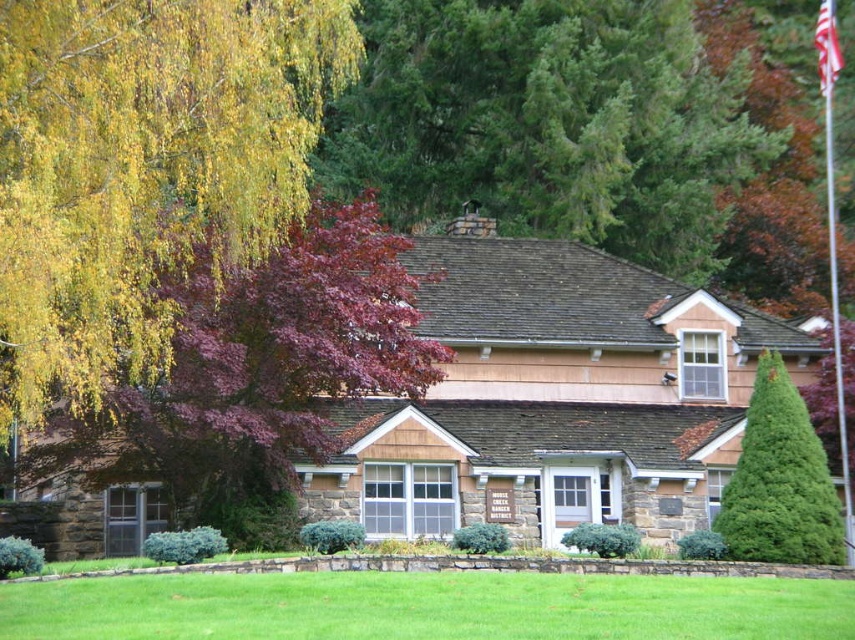
Who is lower down, yellow leafy tree at upper left or purple-leaved tree at left?

purple-leaved tree at left

Who is more distant from viewer, (298,90) or (426,384)?

Point (298,90)

This screenshot has width=855, height=640. What are the coordinates of `yellow leafy tree at upper left` in the screenshot? It's located at (142, 168).

Can you confirm if green grass at lower center is positioned to the right of green needle-like at upper right?

In fact, green grass at lower center is to the left of green needle-like at upper right.

Is point (752, 605) positioned after point (799, 396)?

No, (752, 605) is in front of (799, 396).

Does point (606, 596) come behind point (799, 426)?

No, (606, 596) is in front of (799, 426).

Locate an element on the screen. green grass at lower center is located at coordinates (428, 608).

Does silver metallic flag pole at upper right have a greater height compared to red fabric flag at upper right?

Indeed, silver metallic flag pole at upper right has a greater height compared to red fabric flag at upper right.

Describe the element at coordinates (833, 230) in the screenshot. This screenshot has width=855, height=640. I see `silver metallic flag pole at upper right` at that location.

Is point (830, 140) behind point (823, 38)?

Yes, point (830, 140) is behind point (823, 38).

Locate an element on the screen. silver metallic flag pole at upper right is located at coordinates pos(833,230).